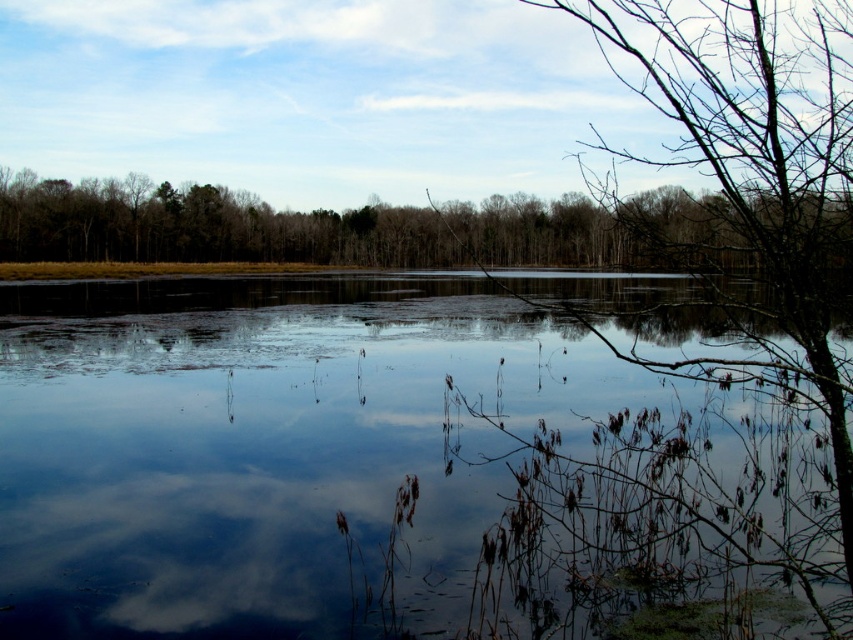
Is transparent water at center bigger than green matte trees at upper center?

No.

The width and height of the screenshot is (853, 640). In order to click on transparent water at center in this screenshot , I will do `click(265, 445)`.

The height and width of the screenshot is (640, 853). What are the coordinates of `transparent water at center` in the screenshot? It's located at (265, 445).

Does transparent water at center lie behind green leafy tree at right?

That is True.

Between point (381, 371) and point (756, 216), which one is positioned in front?

Point (756, 216) is more forward.

Is point (431, 520) farther from camera compared to point (821, 26)?

That is False.

I want to click on transparent water at center, so click(265, 445).

Does green leafy tree at right have a smaller size compared to green matte trees at upper center?

Incorrect, green leafy tree at right is not smaller in size than green matte trees at upper center.

Does green leafy tree at right appear on the right side of green matte trees at upper center?

Correct, you'll find green leafy tree at right to the right of green matte trees at upper center.

The height and width of the screenshot is (640, 853). Describe the element at coordinates (759, 168) in the screenshot. I see `green leafy tree at right` at that location.

Image resolution: width=853 pixels, height=640 pixels. What are the coordinates of `green leafy tree at right` in the screenshot? It's located at (759, 168).